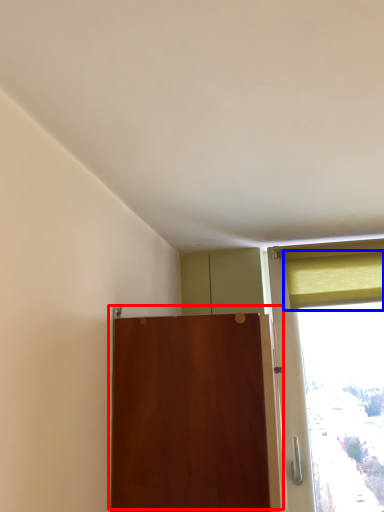
Question: Which of the following is the closest to the observer, door (highlighted by a red box) or curtain (highlighted by a blue box)?

Choices:
 (A) door
 (B) curtain

Answer: (A)